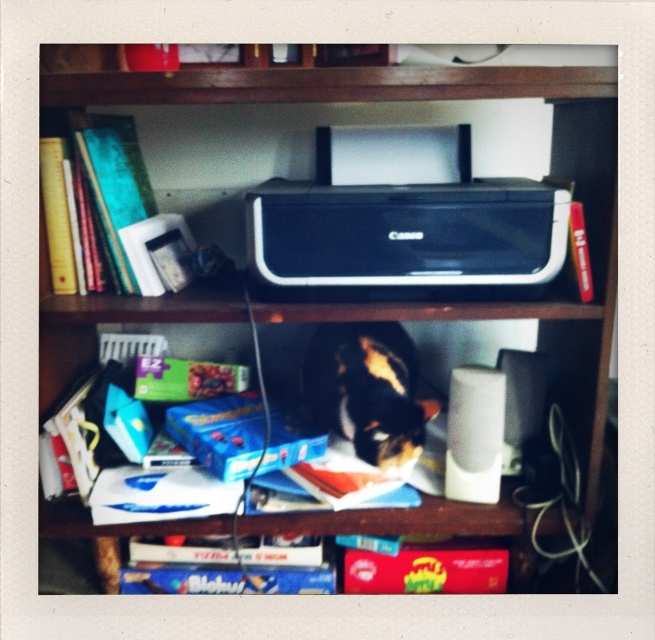
In the scene shown: You need to place a 12 inch ruler between the black plastic printer at center and the camera. Is there enough space?

The black plastic printer at center and camera are 32.64 inches apart, so placing a 12 inch ruler between them would leave 20.64 inches of space remaining.

You are organizing the items on the shelf and need to place a new item that requires space taller than the tallest object currently present. Which object between the calico fur cat at center and the red matte book at center should you consider as the reference for height?

The calico fur cat at center has a greater height compared to the red matte book at center, so you should use the calico fur cat at center as the reference for height.